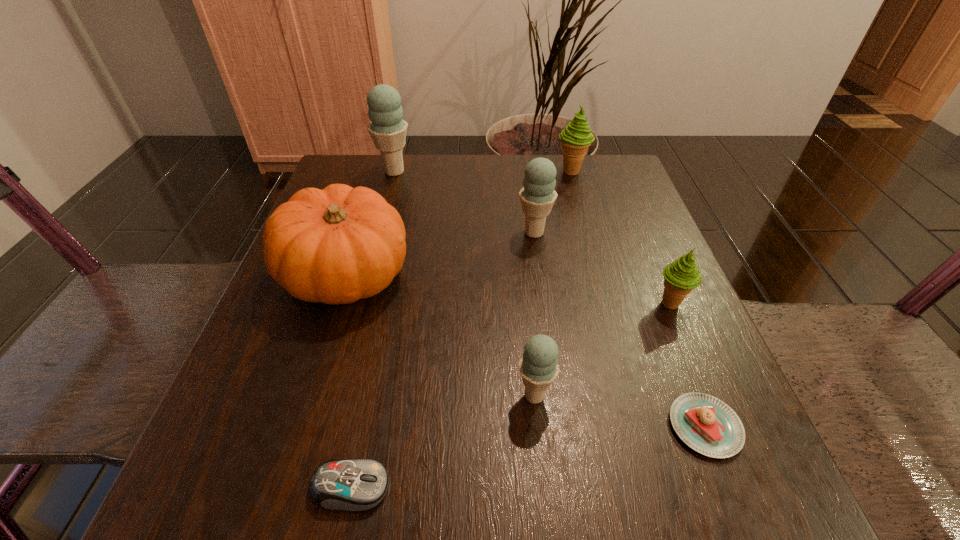
Locate an element on the screen. Image resolution: width=960 pixels, height=540 pixels. the smallest blue ice cream is located at coordinates (538, 366).

Image resolution: width=960 pixels, height=540 pixels. What are the coordinates of `the nearest object` in the screenshot? It's located at (354, 485).

Locate an element on the screen. The width and height of the screenshot is (960, 540). the seventh tallest object is located at coordinates (354, 485).

Where is `pastry`? The height and width of the screenshot is (540, 960). pastry is located at coordinates 706,424.

I want to click on free space located 0.190m on the right of the tallest object, so click(490, 171).

Where is `vacant area located on the left of the bigger green icecream`? The image size is (960, 540). vacant area located on the left of the bigger green icecream is located at coordinates (486, 171).

Locate an element on the screen. This screenshot has height=540, width=960. free point located on the front of the second nearest blue ice cream is located at coordinates (546, 320).

The width and height of the screenshot is (960, 540). Identify the location of vacant position located on the back of the orange pumpkin. (378, 175).

Image resolution: width=960 pixels, height=540 pixels. Identify the location of vacant point located 0.050m on the front of the right green icecream. (685, 340).

What are the coordinates of `free space located on the back of the smallest blue ice cream` in the screenshot? It's located at (519, 240).